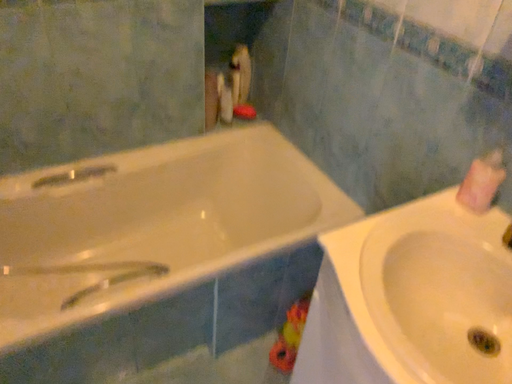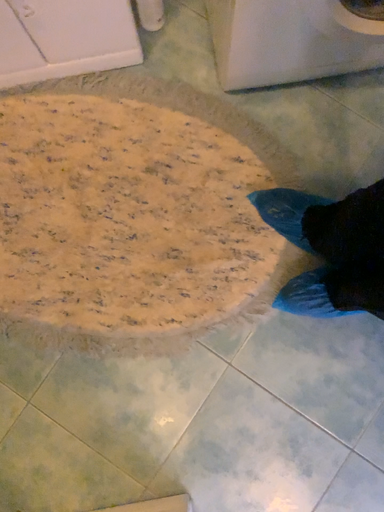
Question: How did the camera likely rotate when shooting the video?

Choices:
 (A) rotated downward
 (B) rotated upward

Answer: (A)